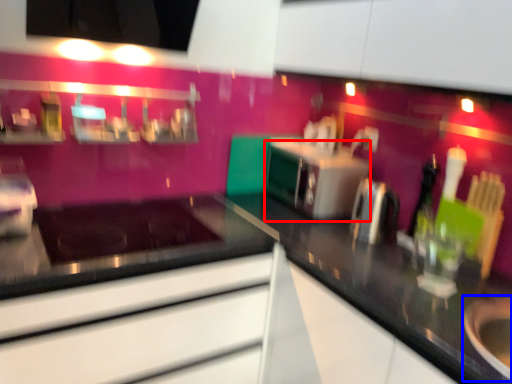
Question: Which of the following is the farthest to the observer, oven (highlighted by a red box) or appliance (highlighted by a blue box)?

Choices:
 (A) oven
 (B) appliance

Answer: (A)